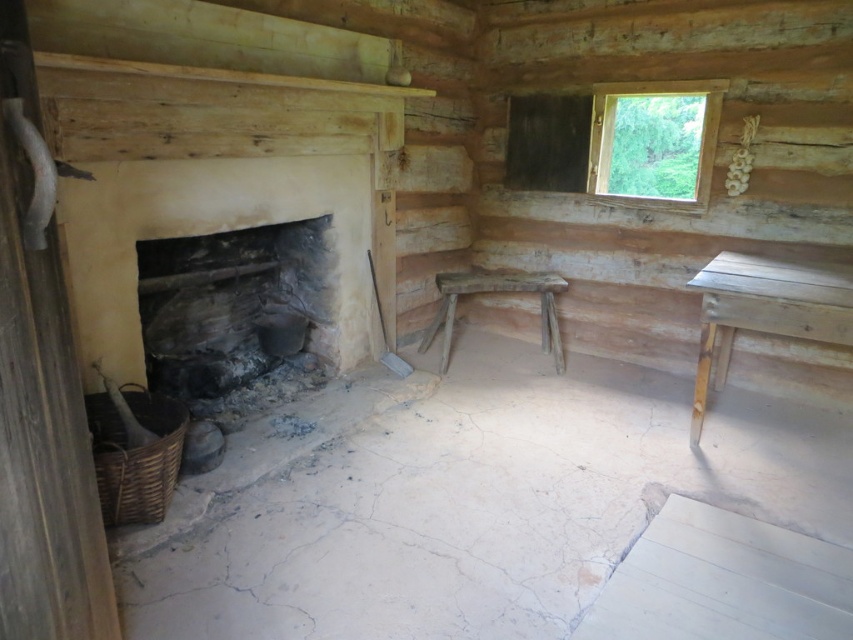
Question: Where is charcoal gray stone fireplace at left located in relation to wooden table at right in the image?

Choices:
 (A) left
 (B) right

Answer: (A)

Question: Which point is closer to the camera?

Choices:
 (A) wooden table at right
 (B) transparent wooden window at upper right

Answer: (A)

Question: Which object appears farthest from the camera in this image?

Choices:
 (A) rustic wooden stool at center
 (B) charcoal gray stone fireplace at left

Answer: (A)

Question: Which object is the farthest from the rustic wooden stool at center?

Choices:
 (A) charcoal gray stone fireplace at left
 (B) transparent wooden window at upper right
 (C) wooden table at right

Answer: (C)

Question: Is charcoal gray stone fireplace at left positioned behind wooden table at right?

Choices:
 (A) yes
 (B) no

Answer: (A)

Question: Is charcoal gray stone fireplace at left positioned at the back of transparent wooden window at upper right?

Choices:
 (A) no
 (B) yes

Answer: (A)